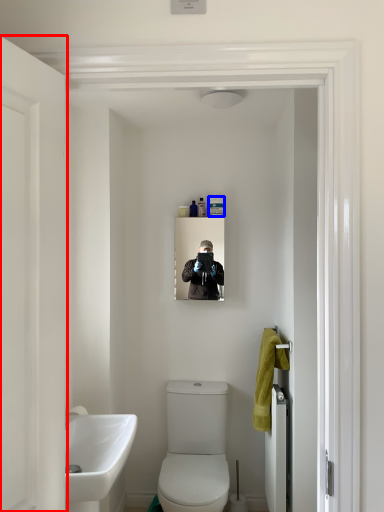
Question: Which object is further to the camera taking this photo, door (highlighted by a red box) or toiletry (highlighted by a blue box)?

Choices:
 (A) door
 (B) toiletry

Answer: (B)